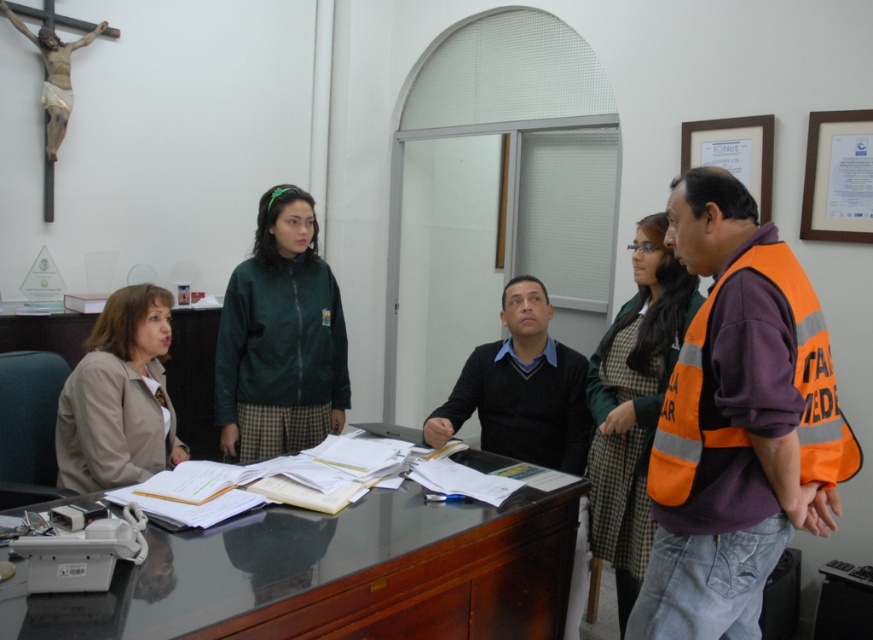
Is point (533, 611) positioned after point (317, 301)?

No, (533, 611) is in front of (317, 301).

You are a GUI agent. You are given a task and a screenshot of the screen. Output one action in this format:
    pyautogui.click(x=<x>, y=<y>)
    Task: Click on the glossy wood table at center
    The height and width of the screenshot is (640, 873).
    Given the screenshot: What is the action you would take?
    pyautogui.click(x=335, y=576)

Does green fabric jacket at center have a greater height compared to black sweater at center?

Correct, green fabric jacket at center is much taller as black sweater at center.

Is green fabric jacket at center thinner than black sweater at center?

Yes.

The image size is (873, 640). In order to click on green fabric jacket at center in this screenshot , I will do `click(633, 404)`.

Who is more forward, (x=225, y=292) or (x=131, y=308)?

Point (x=131, y=308) is more forward.

Describe the element at coordinates (280, 339) in the screenshot. The height and width of the screenshot is (640, 873). I see `green matte jacket at center` at that location.

Who is more distant from viewer, (279, 346) or (139, 371)?

The point (279, 346) is more distant.

You are a GUI agent. You are given a task and a screenshot of the screen. Output one action in this format:
    pyautogui.click(x=<x>, y=<y>)
    Task: Click on the green matte jacket at center
    The height and width of the screenshot is (640, 873).
    Given the screenshot: What is the action you would take?
    pyautogui.click(x=280, y=339)